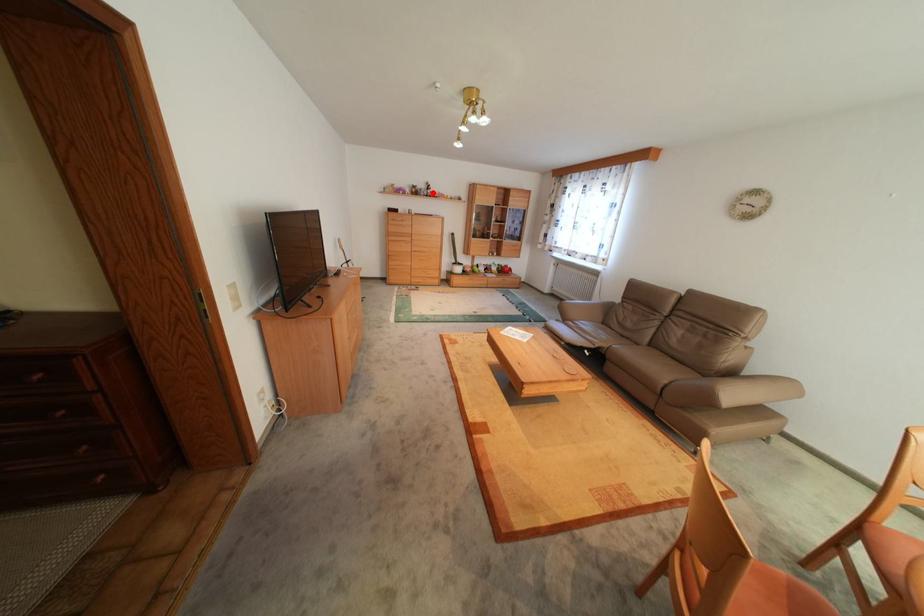
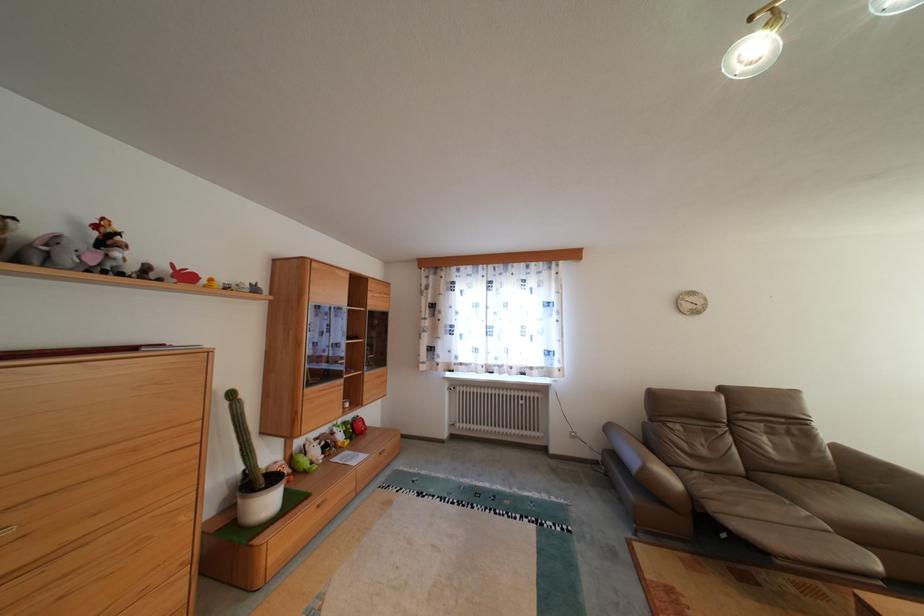
Locate, in the second image, the point that corresponds to the highlighted location in the first image.

(78, 257)